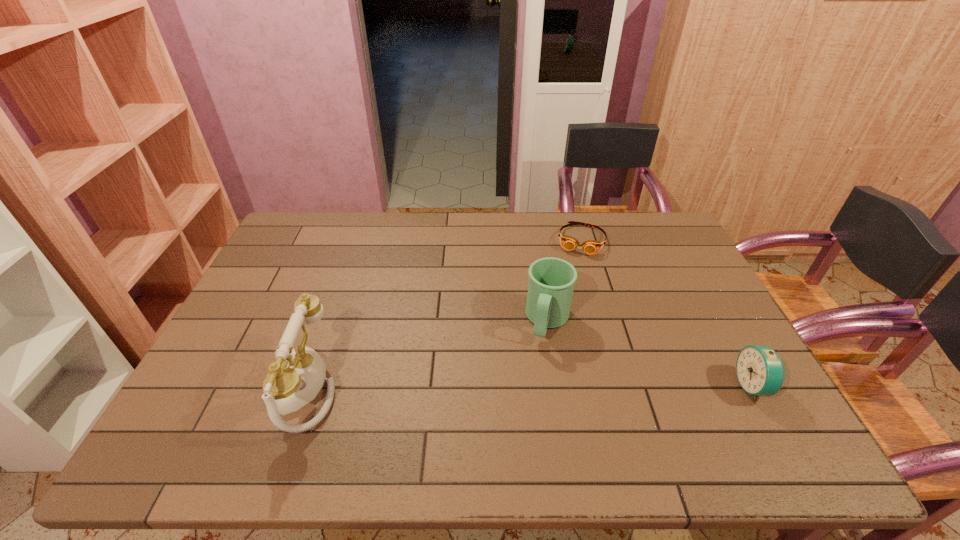
Locate an element on the screen. This screenshot has width=960, height=540. vacant space at the far right corner is located at coordinates (673, 233).

Where is `vacant point located between the telephone and the goggles`? vacant point located between the telephone and the goggles is located at coordinates (443, 314).

Identify the location of free space between the mug and the alarm clock. (651, 354).

Find the location of a particular element. Image resolution: width=960 pixels, height=540 pixels. empty space between the tallest object and the farthest object is located at coordinates (443, 314).

The width and height of the screenshot is (960, 540). What are the coordinates of `free space between the alarm clock and the mug` in the screenshot? It's located at click(x=651, y=354).

Identify the location of free space between the alarm clock and the second object from right to left. The image size is (960, 540). 667,313.

Image resolution: width=960 pixels, height=540 pixels. In order to click on free space between the mug and the second shortest object in this screenshot , I will do `click(651, 354)`.

The height and width of the screenshot is (540, 960). In order to click on empty space between the rightmost object and the second tallest object in this screenshot , I will do `click(651, 354)`.

Where is `free point between the rightmost object and the goggles`? The height and width of the screenshot is (540, 960). free point between the rightmost object and the goggles is located at coordinates (667, 313).

Locate an element on the screen. Image resolution: width=960 pixels, height=540 pixels. object that is the closest to the telephone is located at coordinates (551, 283).